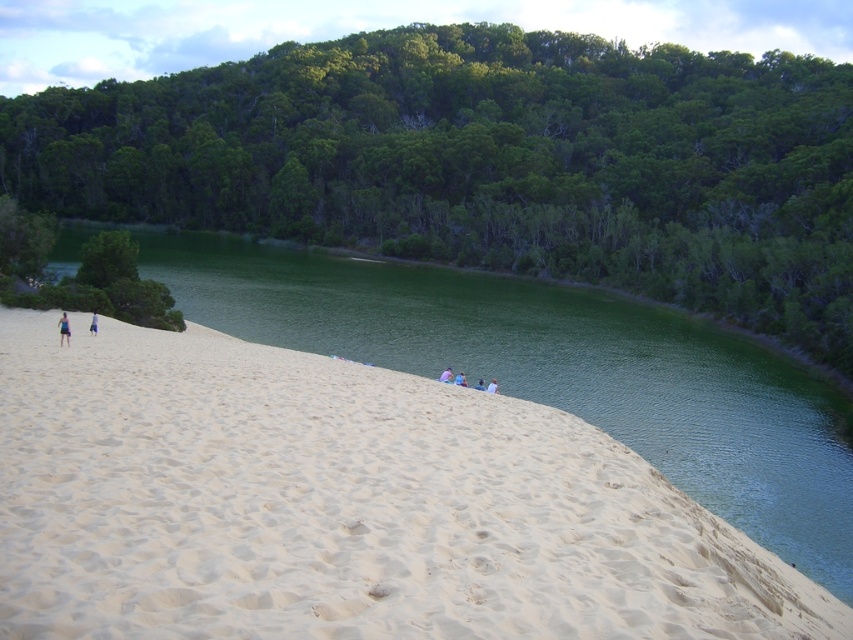
From the picture: You are a photographer planning to capture a landscape photo of the serene natural landscape with the pink fabric person at center and the light blue fabric at left. Which object should be placed closer to the camera to ensure both are in focus?

Since the pink fabric person at center is not as tall as the light blue fabric at left, you should place the light blue fabric at left closer to the camera to ensure both are in focus.

You are standing at the base of the sand dune and want to reach the water. There are two landmarks marked as point (64,340) and point (492,392). Which point should you head towards to get to the water first?

Point (64,340) is closer to the camera than point (492,392), so you should head towards point (64,340) to reach the water first.